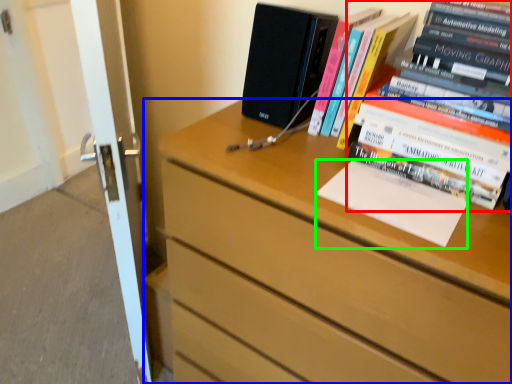
Question: Which object is positioned closest to book (highlighted by a red box)? Select from chest of drawers (highlighted by a blue box) and paperback book (highlighted by a green box).

Choices:
 (A) chest of drawers
 (B) paperback book

Answer: (B)